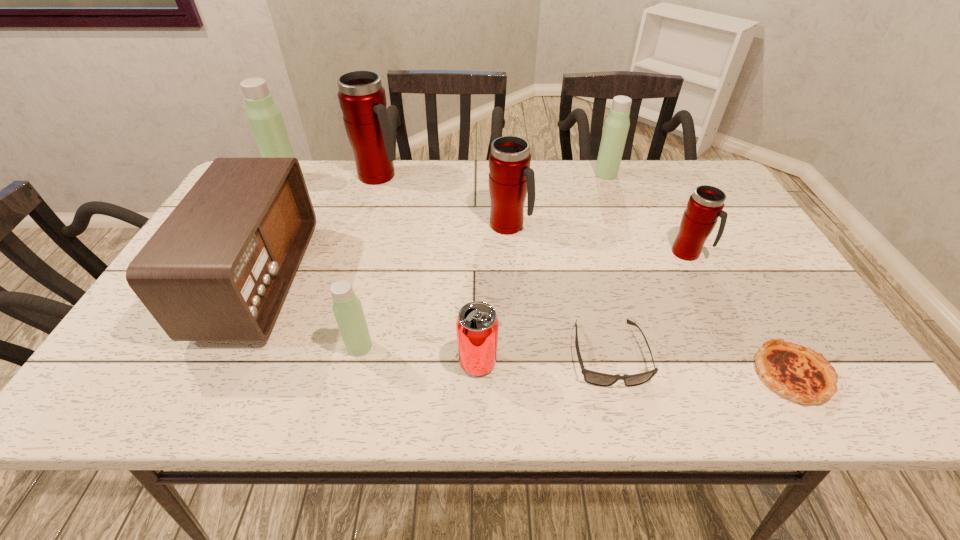
Where is `the biggest light thermos bottle`? The width and height of the screenshot is (960, 540). the biggest light thermos bottle is located at coordinates (265, 119).

This screenshot has height=540, width=960. I want to click on the leftmost thermos bottle, so click(265, 119).

Where is `the farthest red thermos bottle`? the farthest red thermos bottle is located at coordinates (362, 99).

You are a GUI agent. You are given a task and a screenshot of the screen. Output one action in this format:
    pyautogui.click(x=<x>, y=<y>)
    Task: Click on the biggest red thermos bottle
    
    Given the screenshot: What is the action you would take?
    pyautogui.click(x=362, y=99)

This screenshot has height=540, width=960. Find the location of `the second smallest light thermos bottle`. the second smallest light thermos bottle is located at coordinates (616, 126).

The width and height of the screenshot is (960, 540). Find the location of `the fifth thermos bottle from left to right`. the fifth thermos bottle from left to right is located at coordinates (616, 126).

What are the coordinates of `the fourth thermos bottle from left to right` in the screenshot? It's located at tap(510, 177).

Identify the location of the third nearest thermos bottle. (510, 177).

I want to click on radio receiver, so click(x=219, y=268).

At what (x,y) coordinates should I click in order to perform the action: click on the nearest thermos bottle. Please return your answer as a coordinate pair (x, y). Looking at the image, I should click on (347, 308).